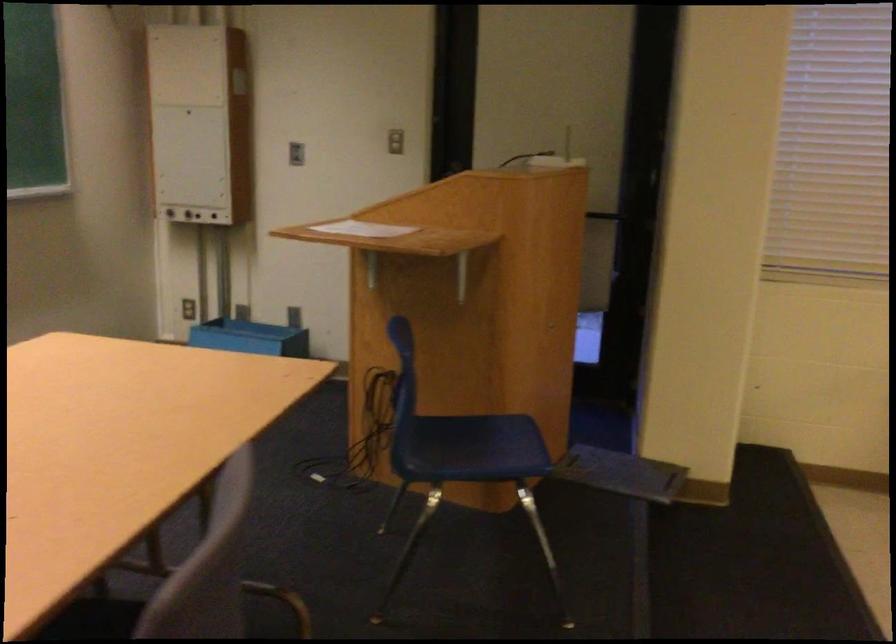
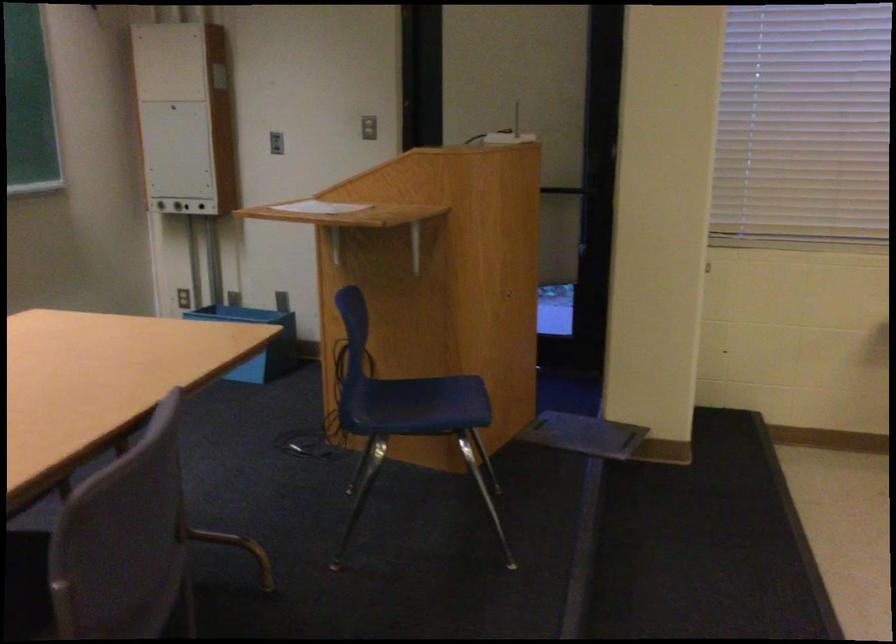
Locate, in the second image, the point that corresponds to point 556,160 in the first image.

(521, 140)